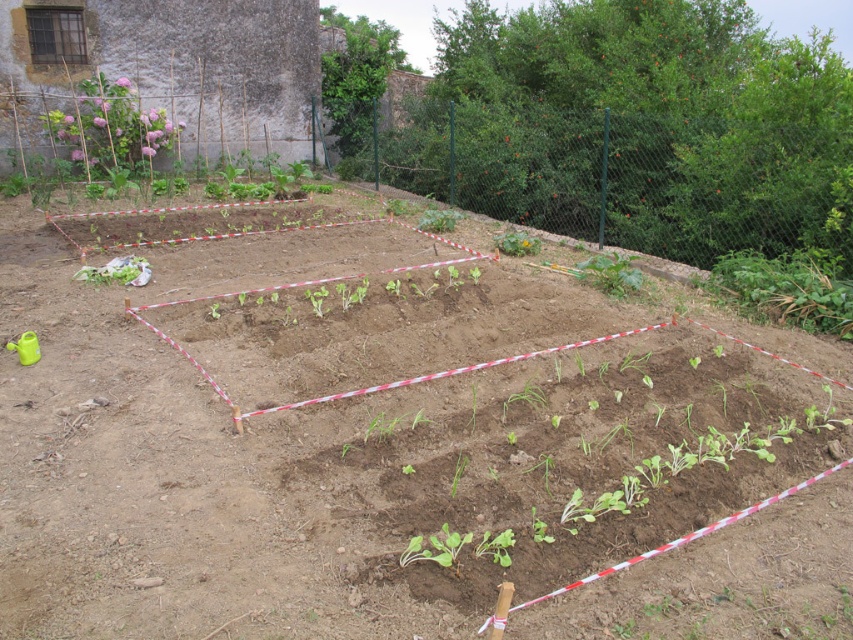
Question: Which object is closer to the camera taking this photo?

Choices:
 (A) green leafy plant at center
 (B) green leafy plant at upper right

Answer: (A)

Question: Is green leafy plant at upper right in front of green leafy plant at center?

Choices:
 (A) yes
 (B) no

Answer: (B)

Question: Is green leafy plant at upper right smaller than green leafy plant at center?

Choices:
 (A) yes
 (B) no

Answer: (B)

Question: Which point is closer to the camera?

Choices:
 (A) green leafy plant at upper right
 (B) green leafy plant at center

Answer: (B)

Question: Is the position of green leafy plant at upper right less distant than that of green leafy plant at center?

Choices:
 (A) yes
 (B) no

Answer: (B)